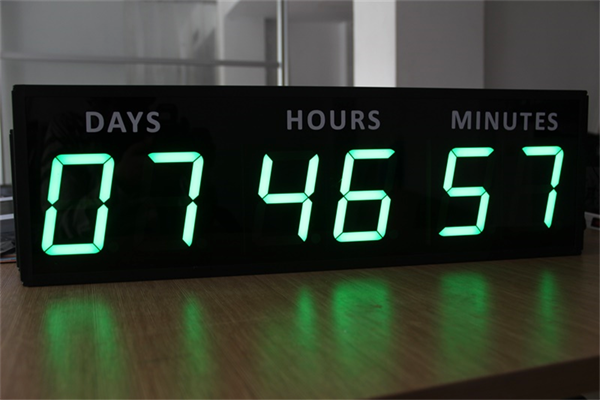
Identify the location of empty space to the left of the clock. Image resolution: width=600 pixels, height=400 pixels. (10, 220).